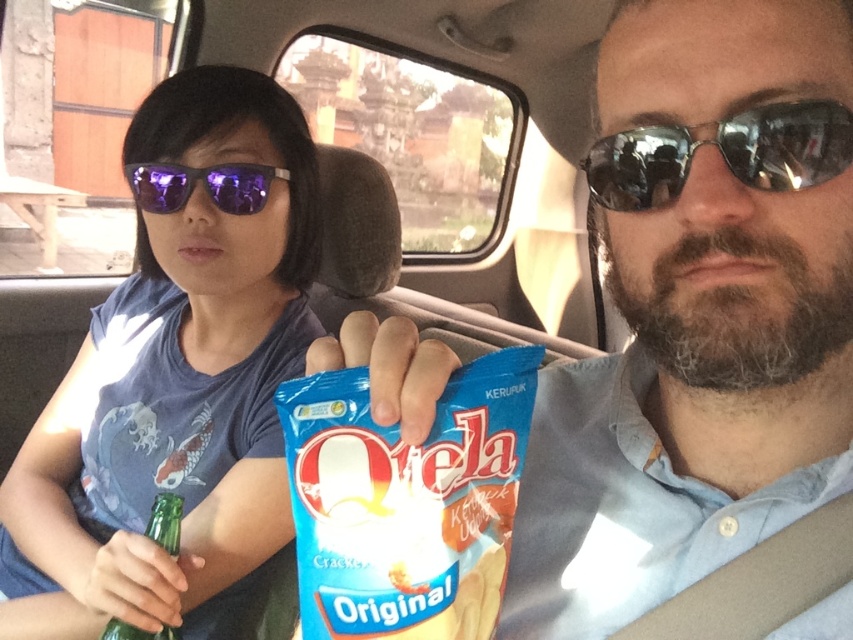
Question: Does blue fabric shirt at left appear on the right side of blue matte qela crackers at center?

Choices:
 (A) yes
 (B) no

Answer: (B)

Question: Estimate the real-world distances between objects in this image. Which object is closer to the blue matte qela crackers at center?

Choices:
 (A) silver reflective sunglasses at upper right
 (B) blue fabric shirt at left
 (C) green glass bottle at lower left

Answer: (A)

Question: Is silver reflective sunglasses at upper right thinner than green glass bottle at lower left?

Choices:
 (A) yes
 (B) no

Answer: (B)

Question: Can you confirm if blue fabric shirt at left is thinner than silver reflective sunglasses at upper right?

Choices:
 (A) yes
 (B) no

Answer: (B)

Question: Based on their relative distances, which object is farther from the purple reflective sunglasses at center?

Choices:
 (A) blue matte qela crackers at center
 (B) green glass bottle at lower left

Answer: (A)

Question: Which point is farther from the camera taking this photo?

Choices:
 (A) (448, 440)
 (B) (160, 522)
 (C) (848, 156)
 (D) (273, 170)

Answer: (D)